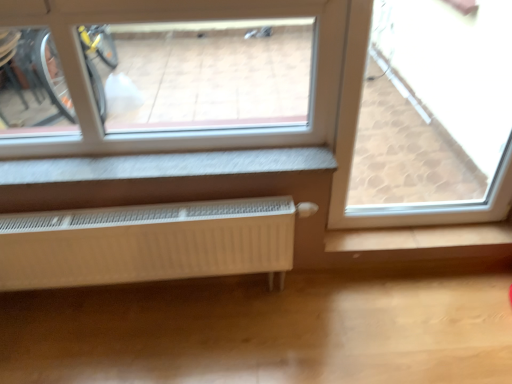
This screenshot has height=384, width=512. In order to click on free area below white matte radiator at lower center (from a real-world perspective) in this screenshot , I will do `click(155, 301)`.